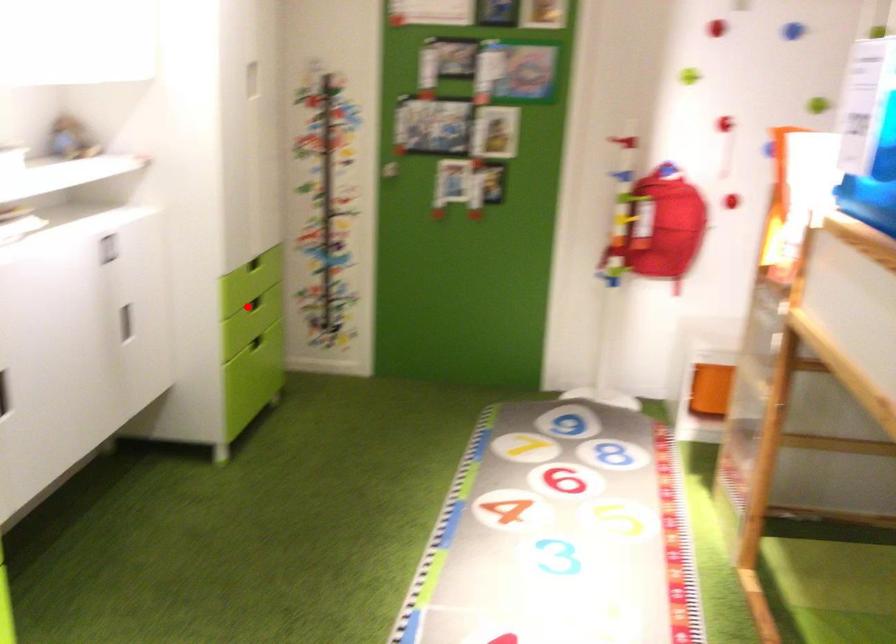
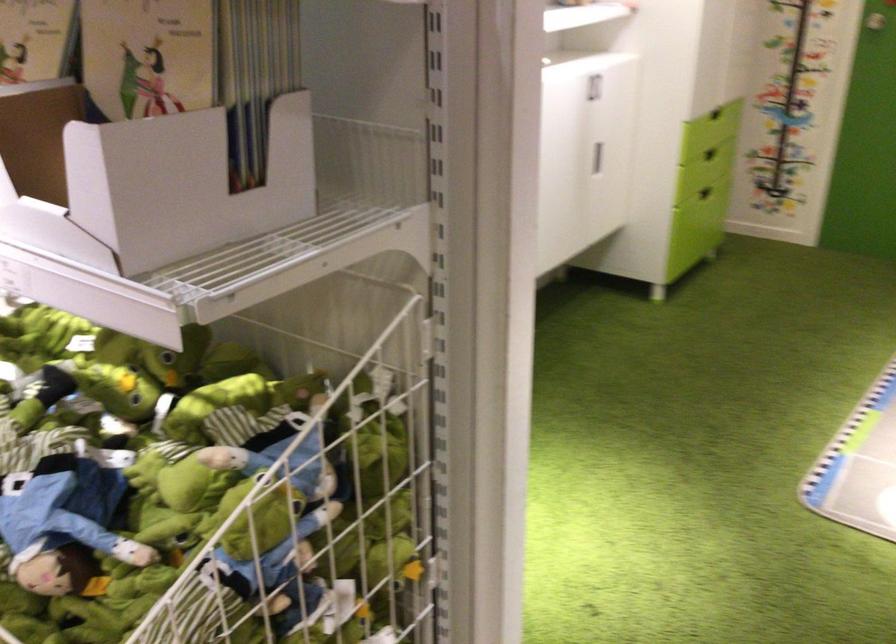
In the second image, find the point that corresponds to the highlighted location in the first image.

(710, 154)